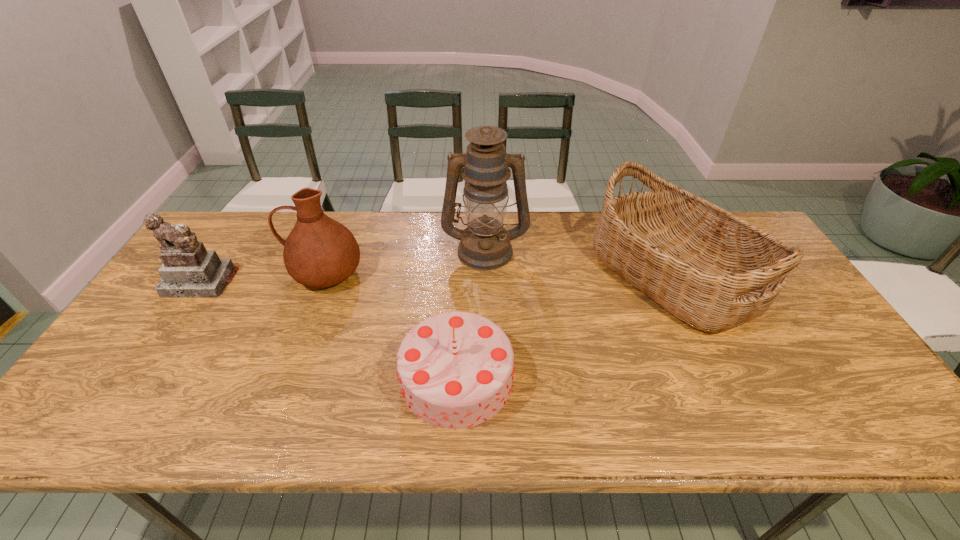
I want to click on free space at the near edge, so click(x=787, y=417).

Identify the location of vacant area at the left edge. (209, 299).

In the image, there is a desktop. Where is `vacant space at the right edge`? vacant space at the right edge is located at coordinates (836, 390).

Locate an element on the screen. free space between the oil lamp and the fourth object from right to left is located at coordinates (405, 261).

The width and height of the screenshot is (960, 540). I want to click on unoccupied position between the basket and the figurine, so click(x=437, y=278).

This screenshot has height=540, width=960. What are the coordinates of `vacant area that lies between the basket and the pitcher` in the screenshot? It's located at (499, 274).

What are the coordinates of `free point between the leftmost object and the shortest object` in the screenshot? It's located at (328, 329).

Find the location of a particular element. The height and width of the screenshot is (540, 960). unoccupied position between the pitcher and the tallest object is located at coordinates (405, 261).

This screenshot has width=960, height=540. Find the location of `free space between the tallest object and the basket`. free space between the tallest object and the basket is located at coordinates (579, 262).

Where is `free spot between the figurine and the rightmost object`? The image size is (960, 540). free spot between the figurine and the rightmost object is located at coordinates (437, 278).